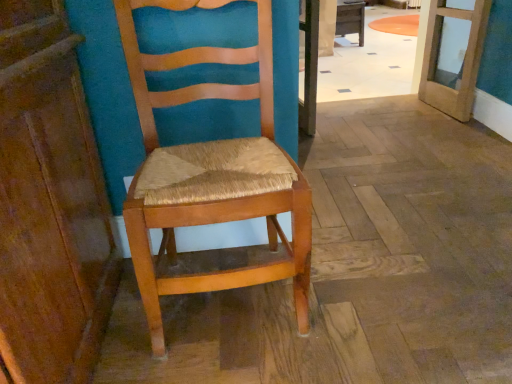
Question: Is wooden table at center positioned far away from wooden door at upper right?

Choices:
 (A) no
 (B) yes

Answer: (B)

Question: From a real-world perspective, is wooden table at center physically above wooden door at upper right?

Choices:
 (A) no
 (B) yes

Answer: (A)

Question: Is wooden table at center smaller than wooden door at upper right?

Choices:
 (A) no
 (B) yes

Answer: (A)

Question: Is wooden table at center outside of wooden door at upper right?

Choices:
 (A) yes
 (B) no

Answer: (A)

Question: Considering the relative sizes of wooden table at center and wooden door at upper right in the image provided, is wooden table at center thinner than wooden door at upper right?

Choices:
 (A) yes
 (B) no

Answer: (B)

Question: Looking at the image, does wooden door at upper right seem bigger or smaller compared to wooden woven seat at center?

Choices:
 (A) big
 (B) small

Answer: (B)

Question: In terms of width, does wooden door at upper right look wider or thinner when compared to wooden woven seat at center?

Choices:
 (A) thin
 (B) wide

Answer: (A)

Question: Considering the positions of point (458, 117) and point (124, 218), is point (458, 117) closer or farther from the camera than point (124, 218)?

Choices:
 (A) farther
 (B) closer

Answer: (A)

Question: Visually, is wooden door at upper right positioned to the left or to the right of wooden woven seat at center?

Choices:
 (A) right
 (B) left

Answer: (A)

Question: Considering the positions of wooden table at center and wooden woven seat at center in the image, is wooden table at center wider or thinner than wooden woven seat at center?

Choices:
 (A) wide
 (B) thin

Answer: (A)

Question: Is point (361, 3) positioned closer to the camera than point (265, 135)?

Choices:
 (A) closer
 (B) farther

Answer: (B)

Question: Considering the relative positions of wooden table at center and wooden woven seat at center in the image provided, is wooden table at center to the left or to the right of wooden woven seat at center?

Choices:
 (A) right
 (B) left

Answer: (A)

Question: Is wooden table at center bigger or smaller than wooden woven seat at center?

Choices:
 (A) big
 (B) small

Answer: (A)

Question: Considering the positions of wooden door at upper right and wooden table at center in the image, is wooden door at upper right taller or shorter than wooden table at center?

Choices:
 (A) tall
 (B) short

Answer: (A)

Question: From the image's perspective, is wooden door at upper right above or below wooden table at center?

Choices:
 (A) below
 (B) above

Answer: (A)